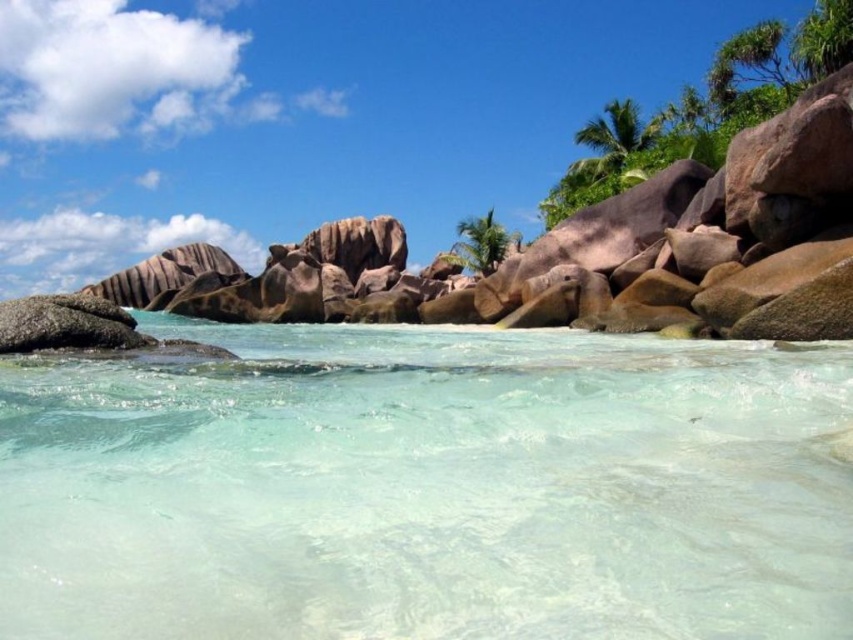
You are standing on the beach and want to take a photo of both the clear water at center and the green leafy palm tree at center. Which object will appear closer to the camera in the photo?

The clear water at center will appear closer to the camera in the photo because it is shorter than the green leafy palm tree at center, so it is positioned in front of the taller palm tree.

You are standing on the beach and want to reach the clear water at center. Based on the coordinates provided, in which direction should you move relative to your current position?

The clear water at center is located at coordinates point [427,488], so you should move towards the right and slightly forward to reach it.